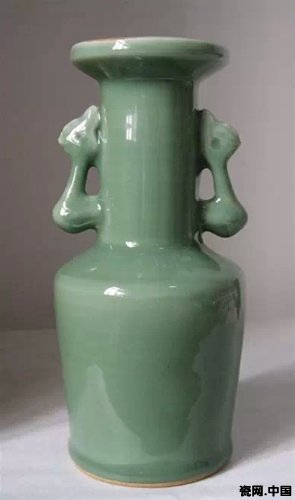
At what (x,y) coordinates should I click in order to perform the action: click on marble countertop. Please return your answer as a coordinate pair (x, y). This screenshot has height=500, width=295. Looking at the image, I should click on (69, 480).